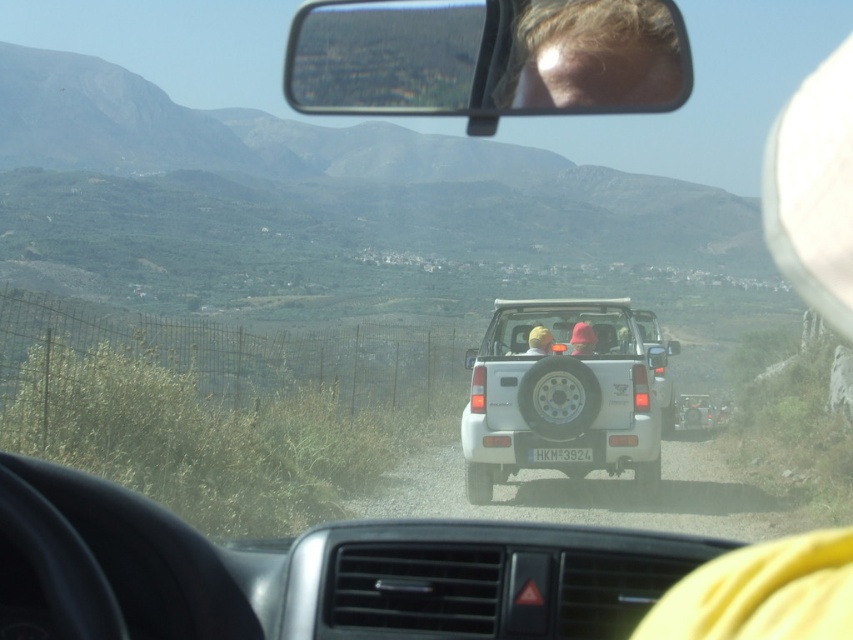
Is point (561, 458) closer to viewer compared to point (541, 353)?

Yes, it is.

Can you confirm if white plastic license plate at rear is positioned to the left of yellow fabric headscarf at rear center?

Incorrect, white plastic license plate at rear is not on the left side of yellow fabric headscarf at rear center.

You are a GUI agent. You are given a task and a screenshot of the screen. Output one action in this format:
    pyautogui.click(x=<x>, y=<y>)
    Task: Click on the white plastic license plate at rear
    The width and height of the screenshot is (853, 640).
    Given the screenshot: What is the action you would take?
    pyautogui.click(x=560, y=454)

In the scene shown: Is clear plastic view mirror at upper center positioned behind yellow fabric headscarf at rear center?

No, clear plastic view mirror at upper center is closer to the viewer.

Which is in front, point (579, 42) or point (532, 353)?

Point (579, 42) is more forward.

Image resolution: width=853 pixels, height=640 pixels. Find the location of `clear plastic view mirror at upper center`. clear plastic view mirror at upper center is located at coordinates [486, 58].

Can you confirm if clear plastic view mirror at upper center is shorter than white matte jeep at rear?

Yes, clear plastic view mirror at upper center is shorter than white matte jeep at rear.

Is clear plastic view mirror at upper center above white matte jeep at rear?

Indeed, clear plastic view mirror at upper center is positioned over white matte jeep at rear.

Which is in front, point (416, 3) or point (608, 368)?

Point (416, 3) is more forward.

Locate an element on the screen. Image resolution: width=853 pixels, height=640 pixels. clear plastic view mirror at upper center is located at coordinates [x=486, y=58].